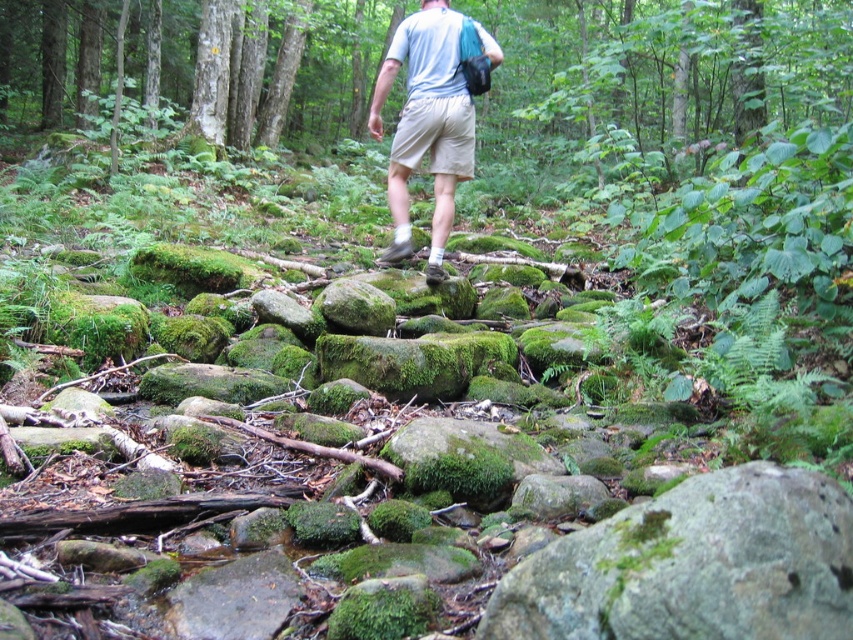
You are the person in the forest scene. You want to place your black bag on a surface that is higher than your light beige shorts at center. Can you use the green mossy rock at center for this purpose?

The green mossy rock at center is located below the light beige shorts at center, so it is lower than your shorts. Therefore, you cannot place your black bag on the green mossy rock at center to have it higher than your light beige shorts at center.